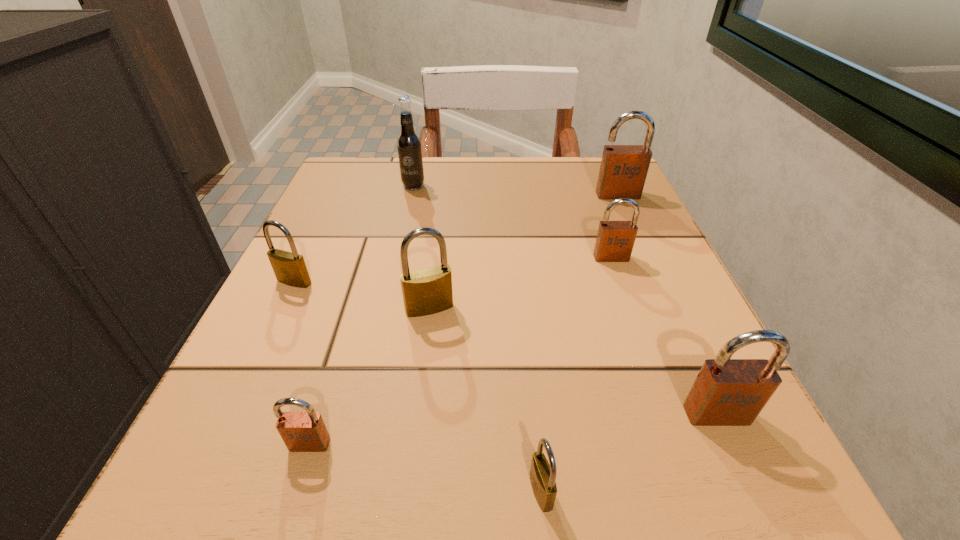
The width and height of the screenshot is (960, 540). In order to click on the sixth nearest object in this screenshot , I will do `click(615, 240)`.

You are a GUI agent. You are given a task and a screenshot of the screen. Output one action in this format:
    pyautogui.click(x=<x>, y=<y>)
    Task: Click on the nearest object
    Image resolution: width=960 pixels, height=540 pixels.
    Given the screenshot: What is the action you would take?
    pyautogui.click(x=542, y=475)

The width and height of the screenshot is (960, 540). Identify the location of the rightmost brass padlock. (542, 475).

I want to click on the smallest brown padlock, so click(x=300, y=431).

The image size is (960, 540). I want to click on the seventh farthest object, so click(x=300, y=431).

Identify the location of vacant space located on the label of the root beer. (383, 321).

What are the coordinates of `free space located 0.170m on the front-facing side of the biggest brown padlock` in the screenshot? It's located at coord(642,249).

Find the location of `free space located on the back of the fourth farthest padlock`. free space located on the back of the fourth farthest padlock is located at coordinates (439, 231).

The width and height of the screenshot is (960, 540). What are the coordinates of `free region located on the front of the fifth nearest padlock` in the screenshot? It's located at (191, 498).

Locate an element on the screen. vacant space positioned 0.200m on the front-facing side of the third nearest brown padlock is located at coordinates (645, 352).